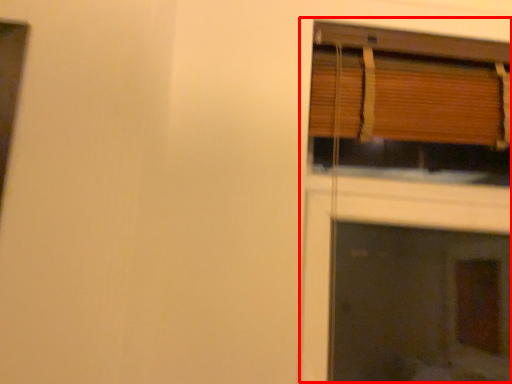
Question: In this image, where is fireplace (annotated by the red box) located relative to window?

Choices:
 (A) right
 (B) left

Answer: (A)